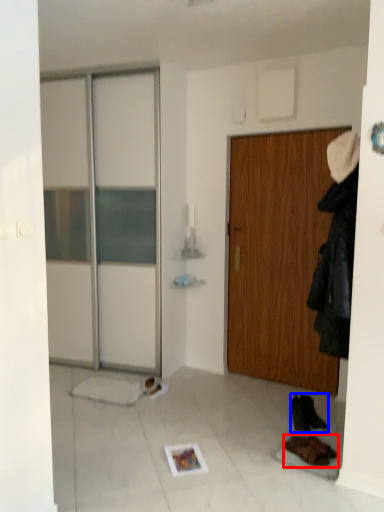
Question: Which object appears farthest to the camera in this image, footwear (highlighted by a red box) or footwear (highlighted by a blue box)?

Choices:
 (A) footwear
 (B) footwear

Answer: (B)